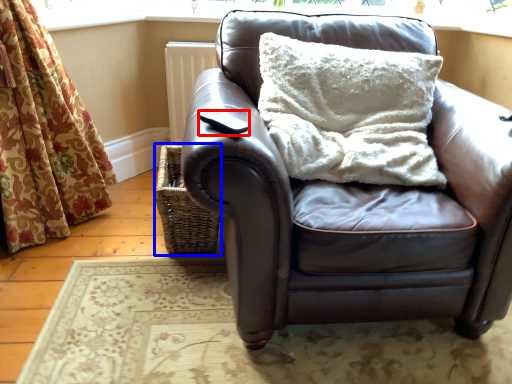
Question: Which object appears farthest to the camera in this image, pad (highlighted by a red box) or basket (highlighted by a blue box)?

Choices:
 (A) pad
 (B) basket

Answer: (B)